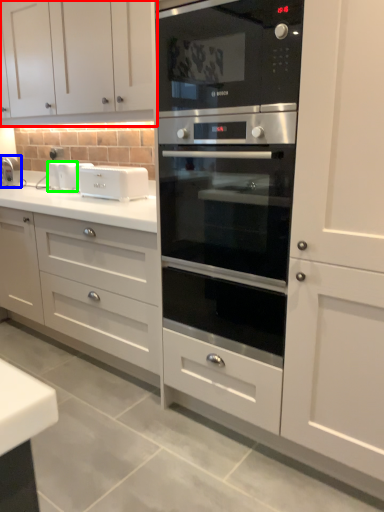
Question: Which object is the closest to the cabinetry (highlighted by a red box)? Choose among these: faucet (highlighted by a blue box) or appliance (highlighted by a green box).

Choices:
 (A) faucet
 (B) appliance

Answer: (B)